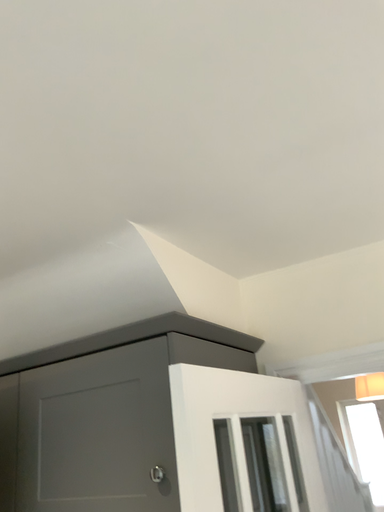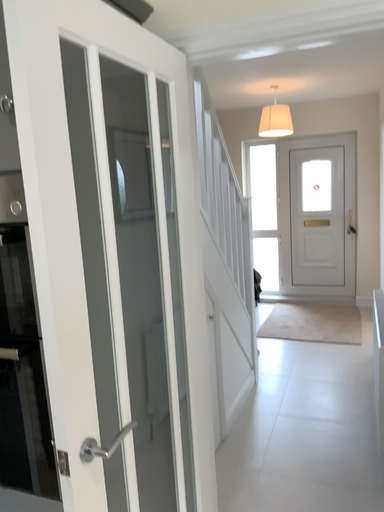
Question: Which way did the camera rotate in the video?

Choices:
 (A) rotated right
 (B) rotated left

Answer: (A)